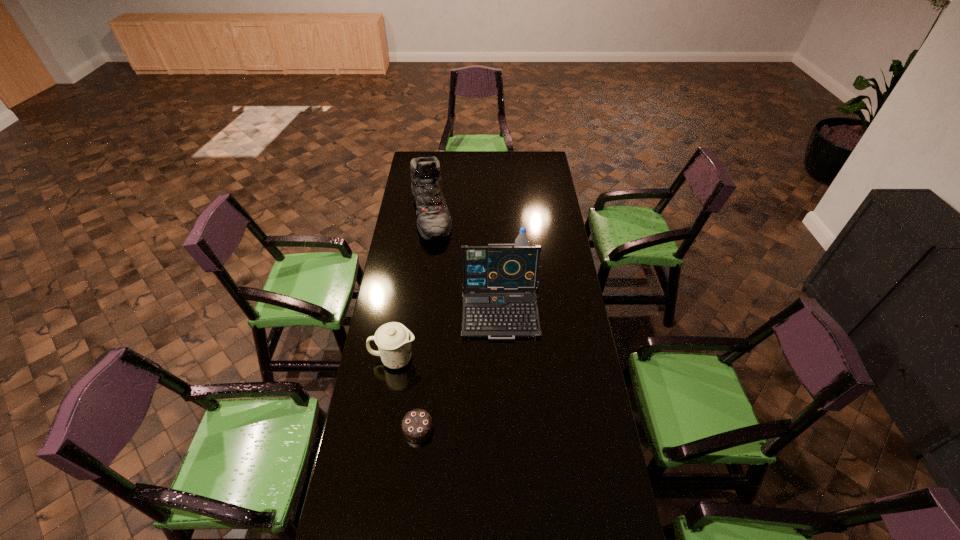
Find the location of a particular element. Image resolution: width=960 pixels, height=540 pixels. vacant space located on the left of the nearest object is located at coordinates (373, 429).

Image resolution: width=960 pixels, height=540 pixels. In order to click on ski boot located in the left edge section of the desktop in this screenshot , I will do `click(434, 223)`.

Where is `chinaware that is at the left edge`? Image resolution: width=960 pixels, height=540 pixels. chinaware that is at the left edge is located at coordinates (393, 339).

At what (x,y) coordinates should I click in order to perform the action: click on chocolate cake situated at the left edge. Please return your answer as a coordinate pair (x, y). Image resolution: width=960 pixels, height=540 pixels. Looking at the image, I should click on (417, 425).

You are a GUI agent. You are given a task and a screenshot of the screen. Output one action in this format:
    pyautogui.click(x=<x>, y=<y>)
    Task: Click on the object located in the right edge section of the desktop
    This screenshot has width=960, height=540.
    Given the screenshot: What is the action you would take?
    pyautogui.click(x=497, y=267)

At what (x,y) coordinates should I click in order to perform the action: click on free space at the far edge of the desktop. Please return your answer as a coordinate pair (x, y). Looking at the image, I should click on (482, 161).

In the image, there is a desktop. At what (x,y) coordinates should I click in order to perform the action: click on free space at the left edge. Please return your answer as a coordinate pair (x, y). The image size is (960, 540). Looking at the image, I should click on (415, 318).

The width and height of the screenshot is (960, 540). I want to click on free space at the right edge of the desktop, so click(x=553, y=181).

The image size is (960, 540). I want to click on unoccupied area between the nearest object and the fourth nearest object, so tap(469, 342).

I want to click on free space between the chinaware and the laptop computer, so click(x=449, y=335).